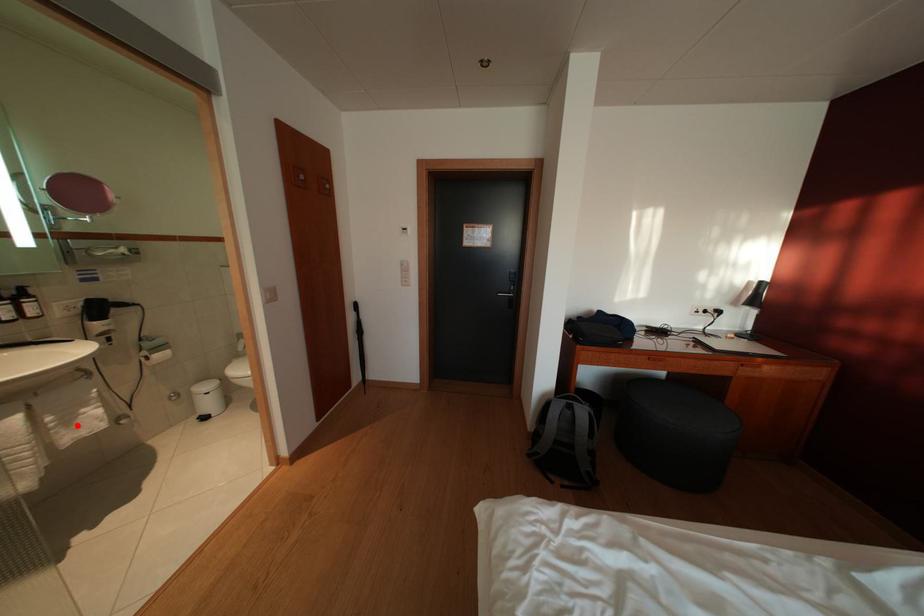
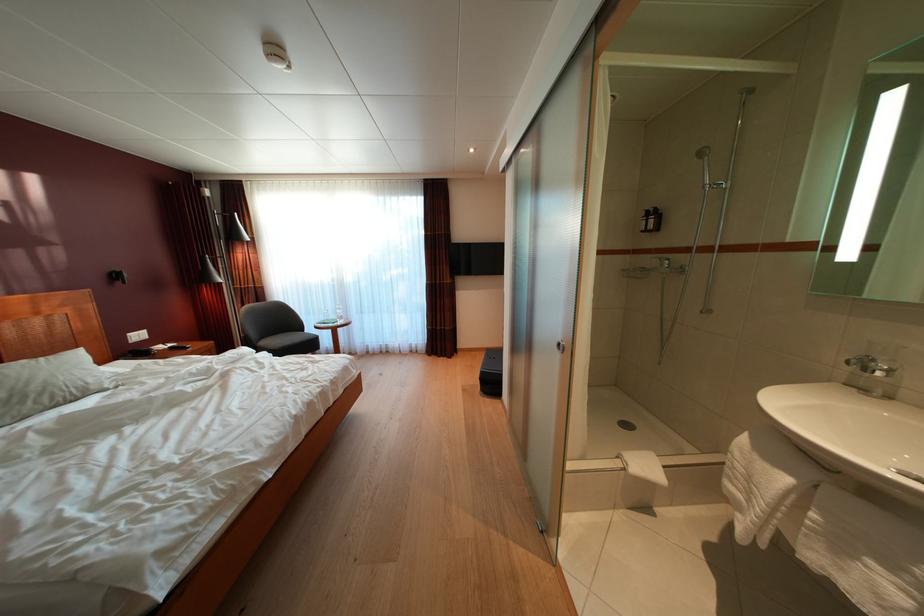
In the second image, find the point that corresponds to the highlighted location in the first image.

(849, 554)